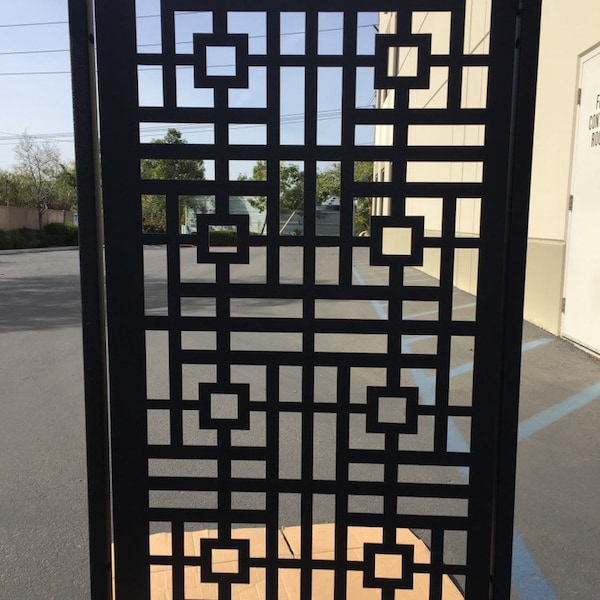
Locate an element on the screen. The image size is (600, 600). door is located at coordinates (541, 272).